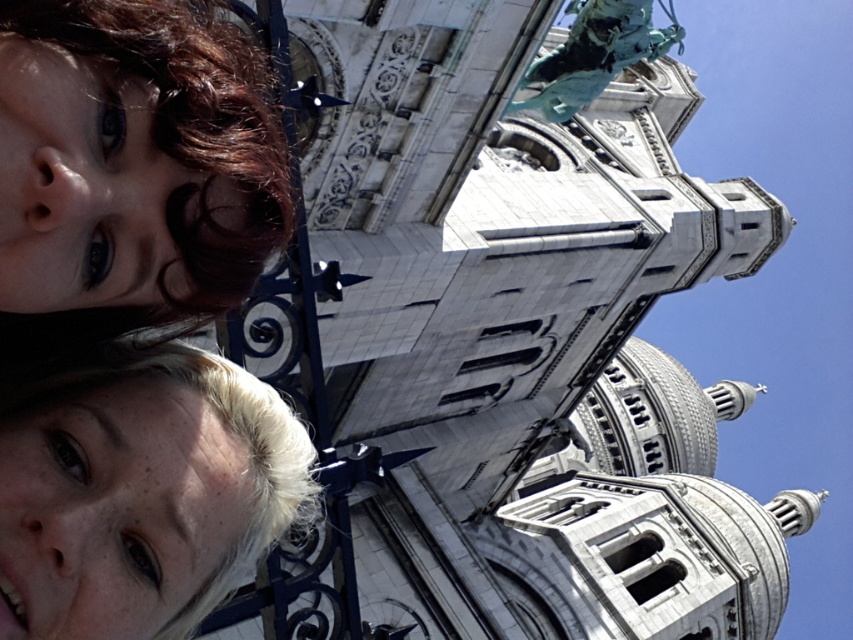
You are a photographer trying to capture a clear shot of the cathedral in the background. You notice two people with matte brown hair at upper left and blonde hair at lower left are blocking your view. Based on their positions, which person is closer to the camera and might be easier to ask to step aside?

The matte brown hair at upper left is taller than the blonde hair at lower left, so it is closer to the camera. Therefore, the person with matte brown hair at upper left is easier to ask to step aside to unblock the view of the cathedral.

You are standing in front of a cathedral and want to take a photo of the white stone tower at upper center without including the blonde hair at lower left in the frame. Based on their positions, is this possible?

The white stone tower at upper center is to the right of the blonde hair at lower left, so you can adjust your camera angle to capture the white stone tower at upper center while excluding the blonde hair at lower left by moving to the right side of the blonde hair at lower left.

You are standing in front of a cathedral and want to take a photo of the white stone tower at upper center. If your camera has a maximum focus range of 40 meters, will it be able to capture the tower clearly?

The white stone tower at upper center is 43.13 meters away from the viewer, which exceeds the camera maximum focus range of 40 meters. Therefore, the camera cannot capture the tower clearly.